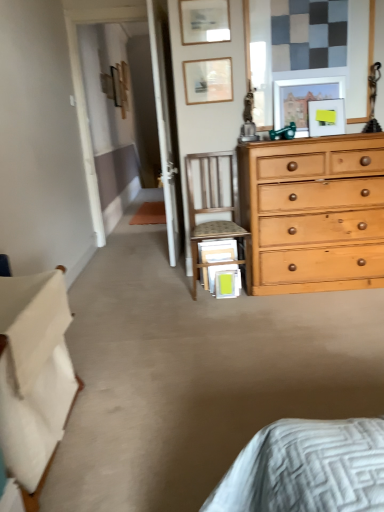
Find the location of a particular element. The height and width of the screenshot is (512, 384). empty space that is ontop of matte wooden picture frame at upper right, the second picture frame from the right (from a real-world perspective) is located at coordinates (308, 76).